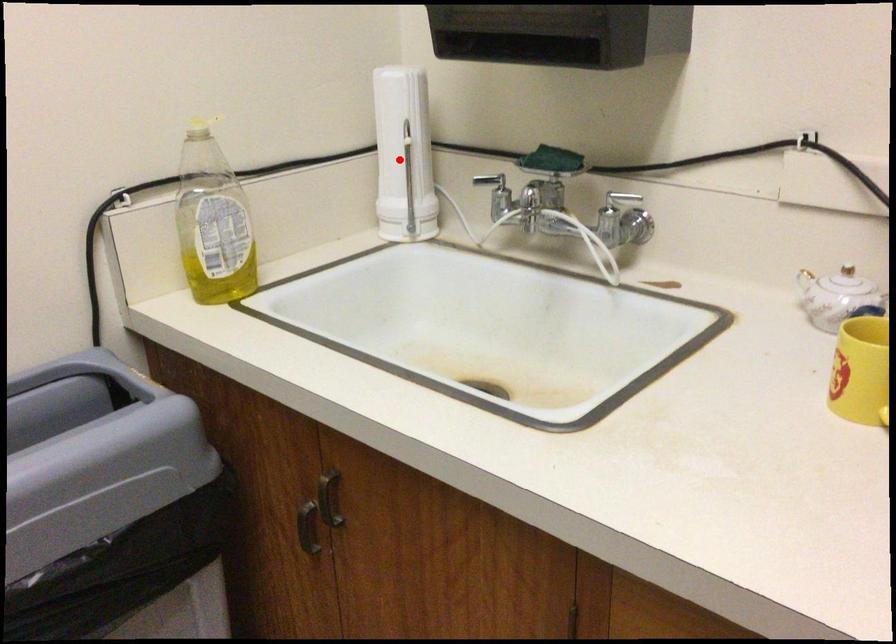
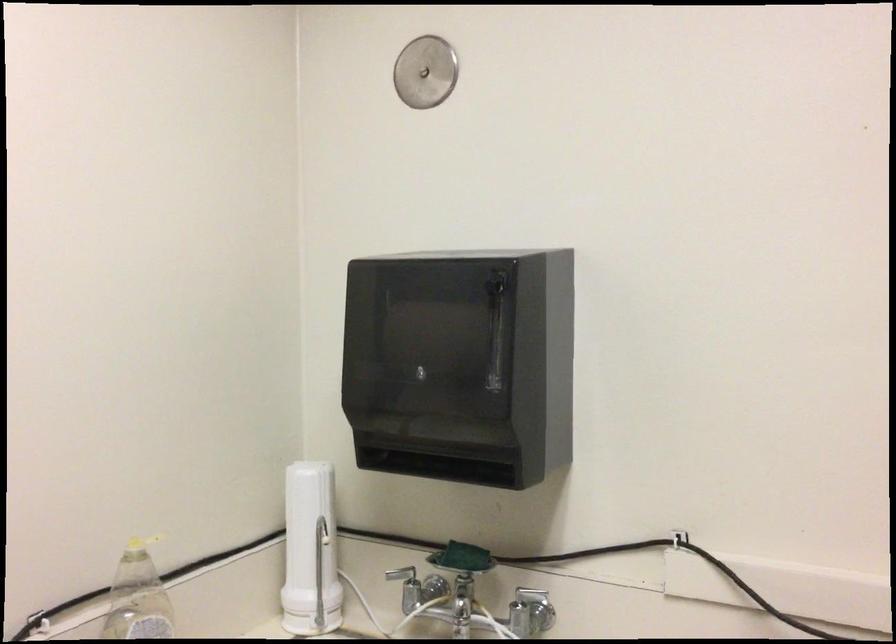
In the second image, find the point that corresponds to the highlighted location in the first image.

(309, 551)